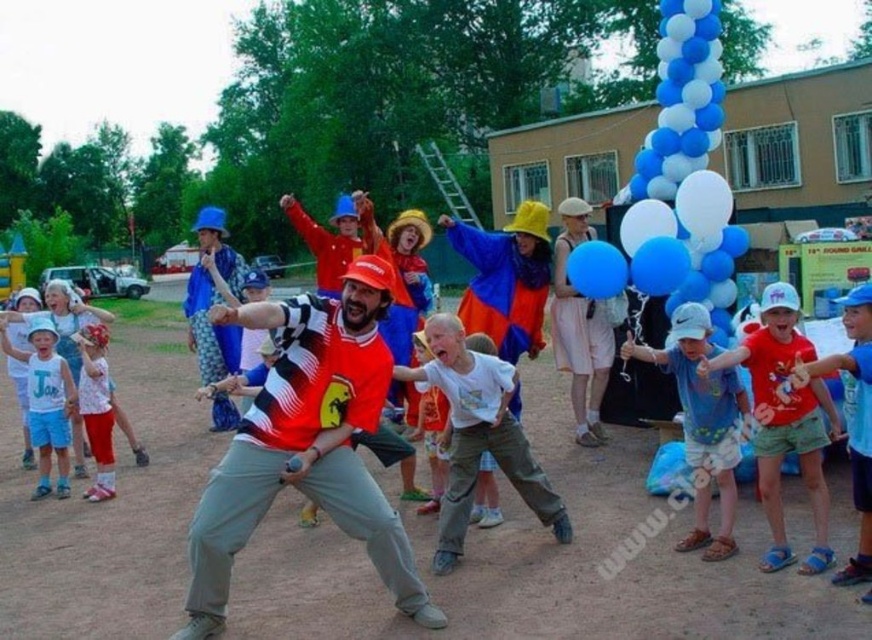
You are organizing a photo shoot and need to place a small prop that requires 20 cm of space. You have two options for placement areas based on the objects in the scene. Which object, the white matte cap at upper right or the matte white shirt at lower left, would provide enough space for the prop?

Result: The white matte cap at upper right has a larger width than the matte white shirt at lower left, so it can accommodate the 20 cm prop.

You are a photographer standing in the middle of the scene. You want to take a photo that includes both the white matte cap at upper right and the matte white shirt at lower left. Which object should you adjust your camera angle to focus on first to ensure both are in frame?

The white matte cap at upper right is much taller than the matte white shirt at lower left, so you should adjust your camera angle to focus on the white matte cap at upper right first to ensure both are in frame.

You are standing in the middle of the group and want to hand out a gift to both the matte white shirt at left and the matte white shirt at lower left. Which one should you approach first to ensure you can reach them without moving past the other?

You should approach the matte white shirt at left first because it is closer to you than the matte white shirt at lower left, which is further away.